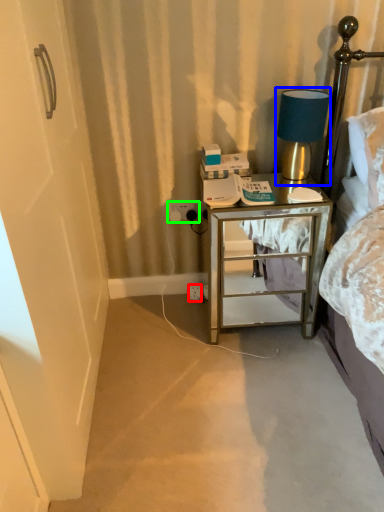
Question: Which object is positioned closest to electric outlet (highlighted by a red box)? Select from table lamp (highlighted by a blue box) and electric outlet (highlighted by a green box).

Choices:
 (A) table lamp
 (B) electric outlet

Answer: (B)